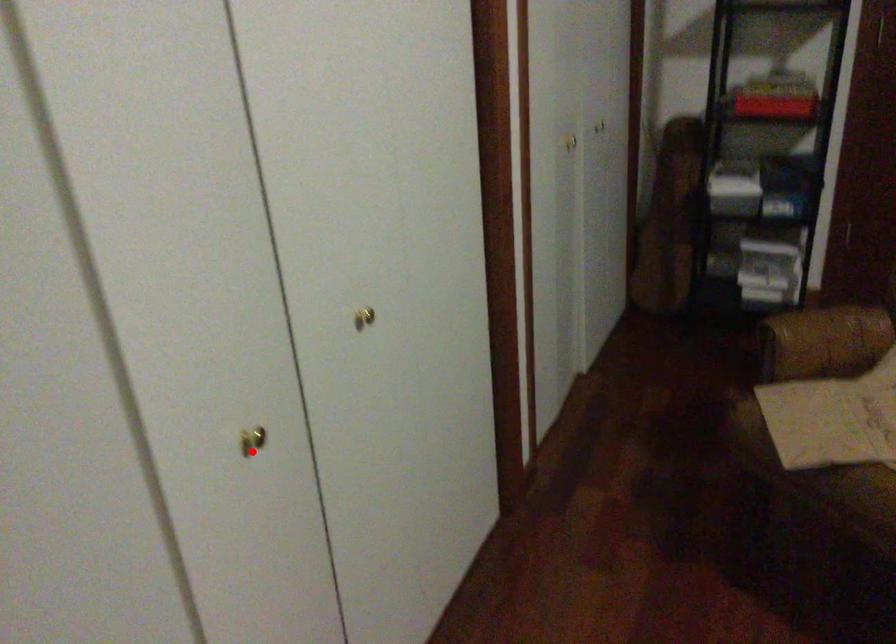
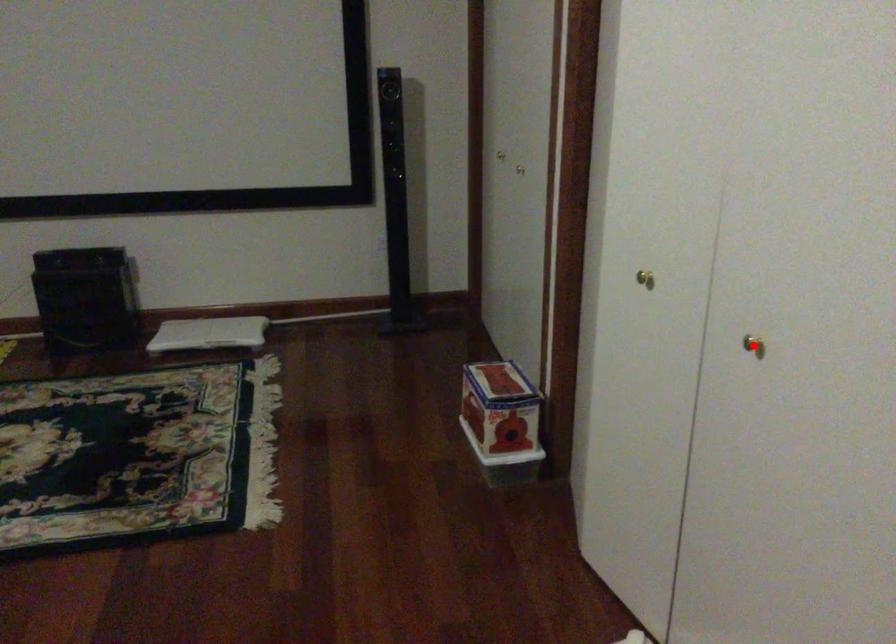
I am providing you with two images of the same scene from different viewpoints. A red point is marked on the first image and another point is marked on the second image. Does the point marked in image1 correspond to the same location as the one in image2?

No